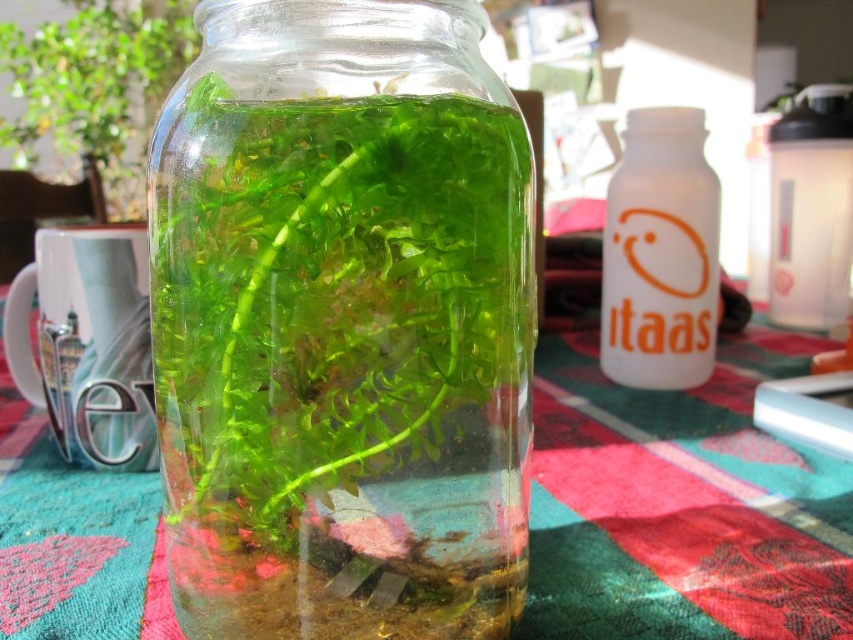
You are organizing items on a table and need to place the transparent glass jar at center and the transparent plastic bottle at upper right. Which one requires more space due to its larger size?

The transparent plastic bottle at upper right requires more space because it is larger than the transparent glass jar at center.

You are looking at the image of the table with the glass jar and other items. There are two points marked on the table surface, one at coordinates point (x=612, y=515) and another at point (x=839, y=301). From your perspective, which point is closer to you?

Point (x=612, y=515) is closer to the camera than point (x=839, y=301).